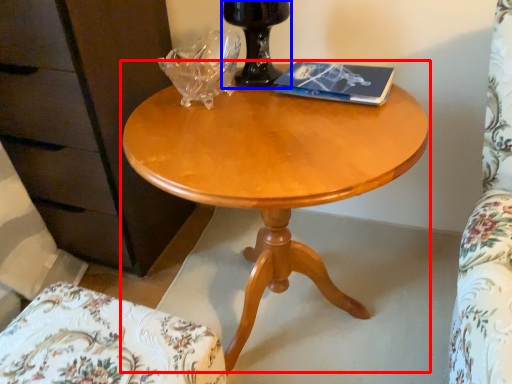
Question: Which object is further to the camera taking this photo, coffee table (highlighted by a red box) or glass vase (highlighted by a blue box)?

Choices:
 (A) coffee table
 (B) glass vase

Answer: (B)